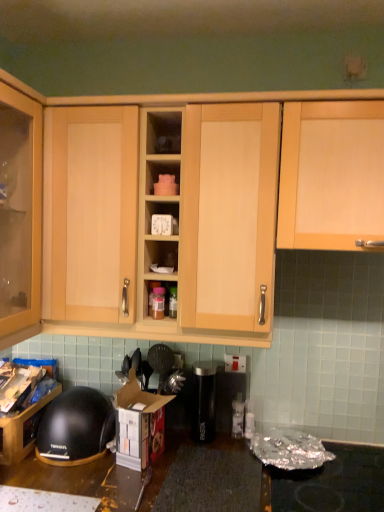
Question: Is light wood cabinet at center, which appears as the 2th cabinetry when viewed from the left, bigger than black plastic bowl at lower left, which is the third cabinetry from right to left?

Choices:
 (A) no
 (B) yes

Answer: (B)

Question: From the image's perspective, is light wood cabinet at center, the second cabinetry when ordered from right to left, located beneath black plastic bowl at lower left, which is the third cabinetry from right to left?

Choices:
 (A) yes
 (B) no

Answer: (B)

Question: From a real-world perspective, is light wood cabinet at center, the second cabinetry when ordered from right to left, physically below black plastic bowl at lower left, which appears as the first cabinetry when viewed from the left?

Choices:
 (A) no
 (B) yes

Answer: (A)

Question: Considering the relative sizes of light wood cabinet at center, the second cabinetry when ordered from right to left, and black plastic bowl at lower left, which is the third cabinetry from right to left, in the image provided, is light wood cabinet at center, the second cabinetry when ordered from right to left, shorter than black plastic bowl at lower left, which is the third cabinetry from right to left,?

Choices:
 (A) yes
 (B) no

Answer: (B)

Question: Does light wood cabinet at center, the second cabinetry when ordered from right to left, contain black plastic bowl at lower left, which appears as the first cabinetry when viewed from the left?

Choices:
 (A) yes
 (B) no

Answer: (B)

Question: From a real-world perspective, does light wood cabinet at center, the second cabinetry when ordered from right to left, stand above black plastic bowl at lower left, which is the third cabinetry from right to left?

Choices:
 (A) no
 (B) yes

Answer: (B)

Question: Is black plastic water filter at center, the second appliance viewed from the left, positioned far away from black plastic canister at center, which ranks as the 2th appliance in right-to-left order?

Choices:
 (A) yes
 (B) no

Answer: (B)

Question: Considering the relative sizes of black plastic water filter at center, which is the first appliance from right to left, and black plastic canister at center, which ranks as the 2th appliance in right-to-left order, in the image provided, is black plastic water filter at center, which is the first appliance from right to left, taller than black plastic canister at center, which ranks as the 2th appliance in right-to-left order,?

Choices:
 (A) no
 (B) yes

Answer: (A)

Question: Can you confirm if black plastic water filter at center, which is the first appliance from right to left, is positioned to the right of black plastic canister at center, which ranks as the 2th appliance in right-to-left order?

Choices:
 (A) yes
 (B) no

Answer: (A)

Question: Can you confirm if black plastic water filter at center, which is the first appliance from right to left, is bigger than black plastic canister at center, which ranks as the 2th appliance in right-to-left order?

Choices:
 (A) no
 (B) yes

Answer: (A)

Question: From the image's perspective, does black plastic water filter at center, which is the first appliance from right to left, appear lower than black plastic canister at center, which appears as the first appliance when viewed from the left?

Choices:
 (A) no
 (B) yes

Answer: (B)

Question: Is black plastic canister at center, which appears as the first appliance when viewed from the left, located within black plastic water filter at center, which is the first appliance from right to left?

Choices:
 (A) yes
 (B) no

Answer: (B)

Question: Considering the relative positions of black matte helmet at lower left and black plastic canister at center, which ranks as the 2th appliance in right-to-left order, in the image provided, is black matte helmet at lower left to the left of black plastic canister at center, which ranks as the 2th appliance in right-to-left order, from the viewer's perspective?

Choices:
 (A) yes
 (B) no

Answer: (A)